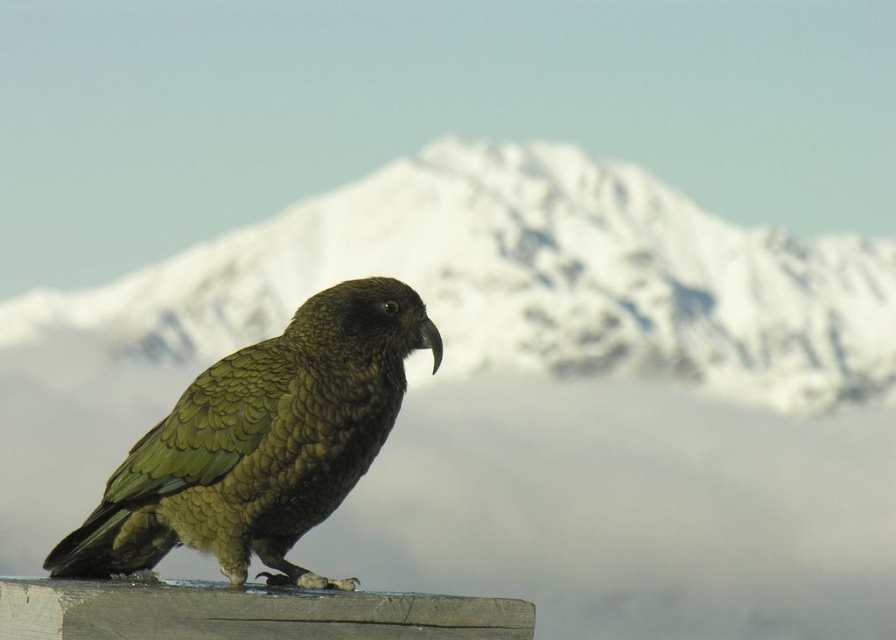
Question: From the image, what is the correct spatial relationship of snowy mountain at upper center in relation to green scaly parrot at center?

Choices:
 (A) below
 (B) above

Answer: (B)

Question: Does snowy mountain at upper center come behind green scaly parrot at center?

Choices:
 (A) yes
 (B) no

Answer: (A)

Question: Does snowy mountain at upper center have a greater width compared to green scaly parrot at center?

Choices:
 (A) yes
 (B) no

Answer: (A)

Question: Which of the following is the farthest from the observer?

Choices:
 (A) green scaly parrot at center
 (B) snowy mountain at upper center

Answer: (B)

Question: Which point appears farthest from the camera in this image?

Choices:
 (A) (703, 289)
 (B) (46, 557)

Answer: (A)